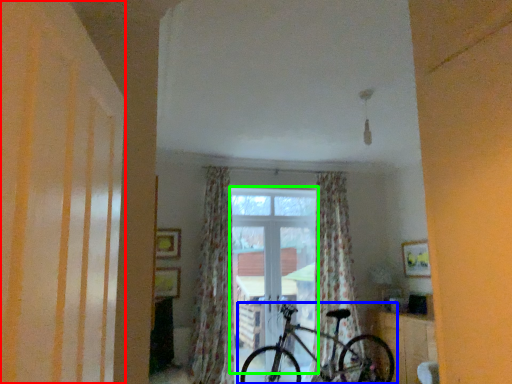
Question: Which is nearer to the shutter (highlighted by a red box)? bicycle (highlighted by a blue box) or window (highlighted by a green box).

Choices:
 (A) bicycle
 (B) window

Answer: (A)